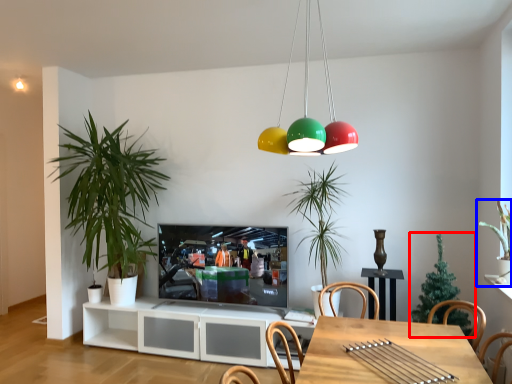
Question: Which point is further to the camera, houseplant (highlighted by a red box) or houseplant (highlighted by a blue box)?

Choices:
 (A) houseplant
 (B) houseplant

Answer: (A)